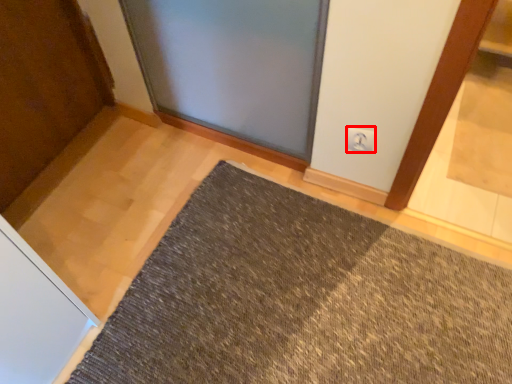
Question: Considering the relative positions of electric outlet (annotated by the red box) and mat in the image provided, where is electric outlet (annotated by the red box) located with respect to the staircase?

Choices:
 (A) left
 (B) right

Answer: (B)